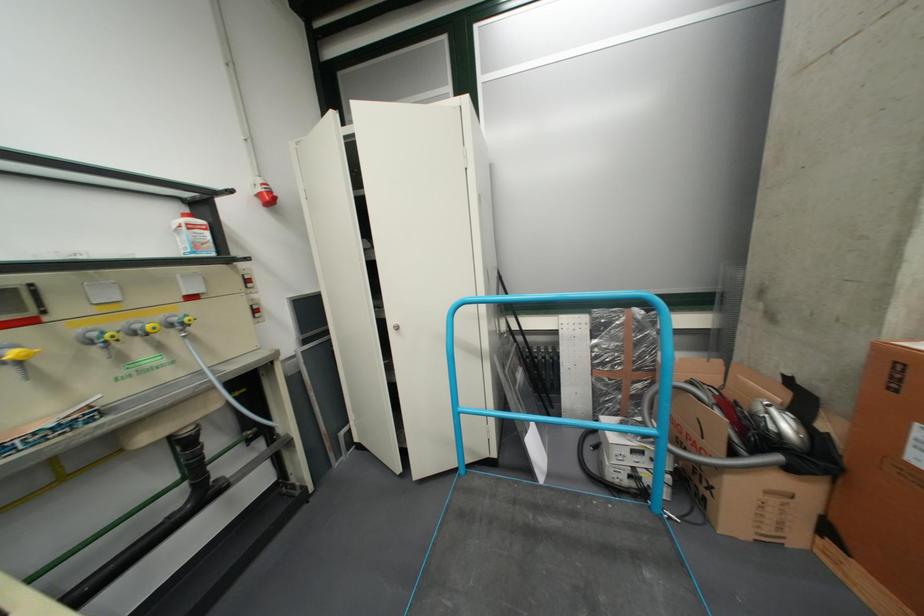
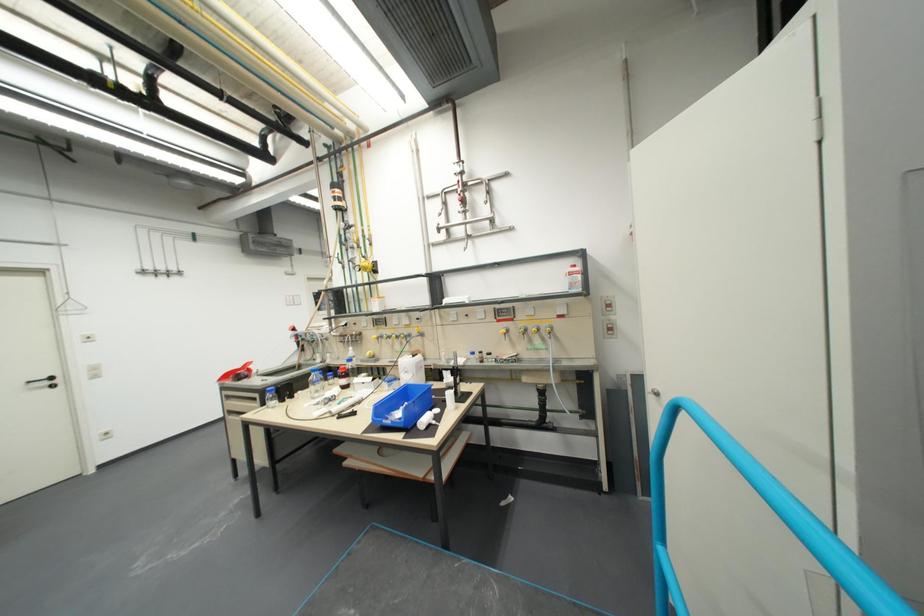
Find the pixel in the second image that matches point 347,466 in the first image.

(652, 498)